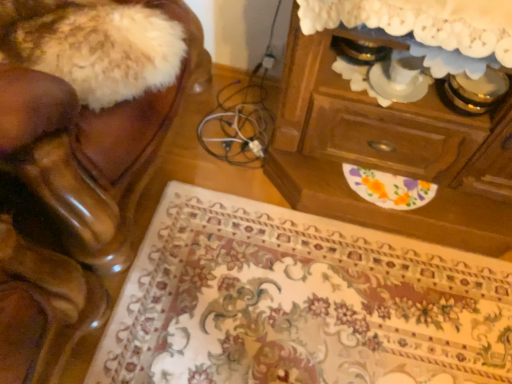
Locate an element on the screen. This screenshot has height=384, width=512. free spot in front of wooden chest of drawers at upper right is located at coordinates (358, 309).